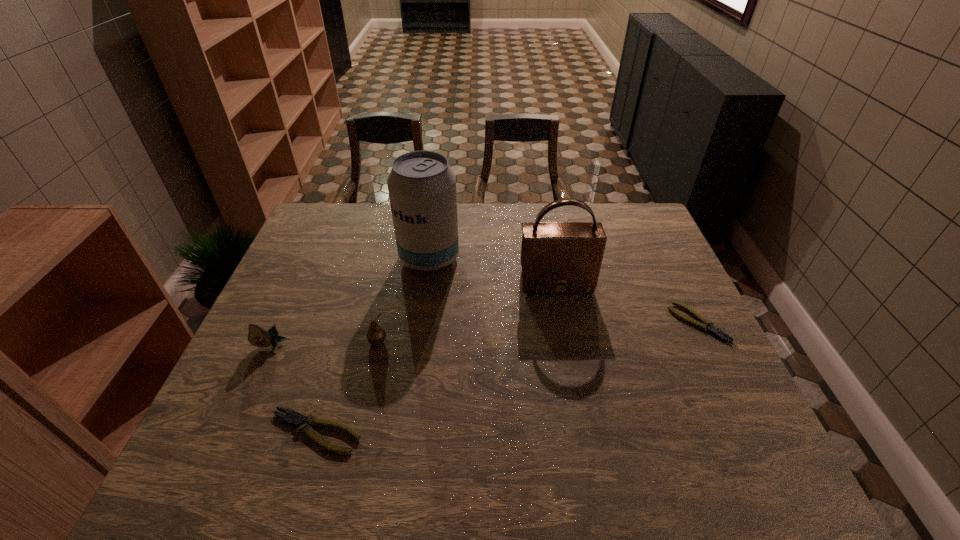
What are the coordinates of `the nearest object` in the screenshot? It's located at (296, 419).

Identify the location of the taller pliers. (296, 419).

This screenshot has width=960, height=540. I want to click on the right pliers, so click(704, 324).

At what (x,y) coordinates should I click in order to perform the action: click on the farther pliers. Please return your answer as a coordinate pair (x, y). This screenshot has height=540, width=960. Looking at the image, I should click on (704, 324).

You are a GUI agent. You are given a task and a screenshot of the screen. Output one action in this format:
    pyautogui.click(x=<x>, y=<y>)
    Task: Click on the fifth shortest object
    This screenshot has height=540, width=960.
    Given the screenshot: What is the action you would take?
    pyautogui.click(x=556, y=257)

The height and width of the screenshot is (540, 960). What are the coordinates of `the fifth object from left to right` in the screenshot? It's located at (556, 257).

At what (x,y) coordinates should I click in order to perform the action: click on alcohol. Please return your answer as a coordinate pair (x, y). This screenshot has width=960, height=540. Looking at the image, I should click on (422, 187).

Locate an element on the screen. This screenshot has width=960, height=540. pear is located at coordinates (376, 335).

Identify the location of avocado. (257, 336).

Identify the location of vacant region located on the back of the nearer pliers. 330,383.